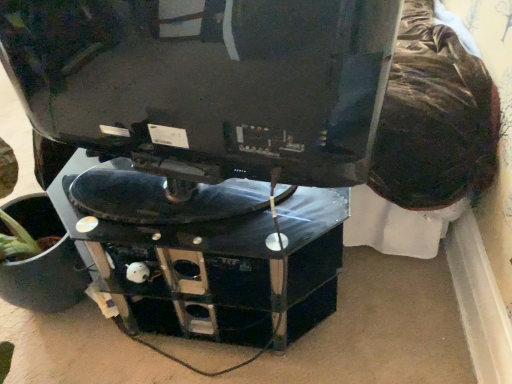
Where is `free region under matte black monitor at upper center (from a real-world perspective)`? The height and width of the screenshot is (384, 512). free region under matte black monitor at upper center (from a real-world perspective) is located at coordinates (185, 223).